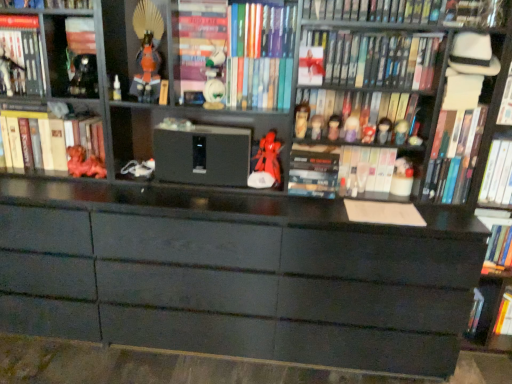
Question: From a real-world perspective, is matte black figurine at center, positioned as the 4th toy in right-to-left order, physically located above or below hardcover book at center?

Choices:
 (A) below
 (B) above

Answer: (B)

Question: Is point (372, 139) closer or farther from the camera than point (332, 168)?

Choices:
 (A) closer
 (B) farther

Answer: (B)

Question: Considering the real-world distances, which object is farthest from the metallic silver figurine at upper left, the 3th toy when ordered from left to right?

Choices:
 (A) hardcover book at right, positioned as the 10th book in left-to-right order
 (B) white glossy book at upper right, the twelfth book when ordered from left to right
 (C) hardcover book at upper center, which appears as the eighth book when viewed from the left
 (D) matte white figurine at center, the eleventh toy in the right-to-left sequence
 (E) matte black figurine at center, which is the thirteenth toy in left-to-right order

Answer: (B)

Question: Which object is positioned closest to the hardcover book at upper right, which ranks as the 7th book in right-to-left order?

Choices:
 (A) matte black figurine at upper right, the 2th toy when ordered from right to left
 (B) white matte cupcake at center-right, which ranks as the 16th toy in left-to-right order
 (C) matte red figurine at upper center, the 8th toy viewed from the right
 (D) hardcover book at upper right, arranged as the third book when viewed from the right
 (E) matte black cabinet at lower right, the 1th cabinet from the back

Answer: (C)